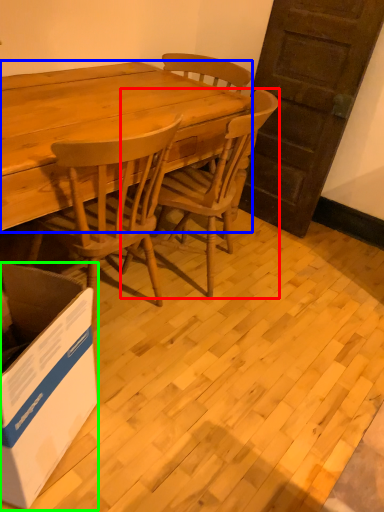
Question: Which is nearer to the chair (highlighted by a red box)? desk (highlighted by a blue box) or box (highlighted by a green box).

Choices:
 (A) desk
 (B) box

Answer: (A)